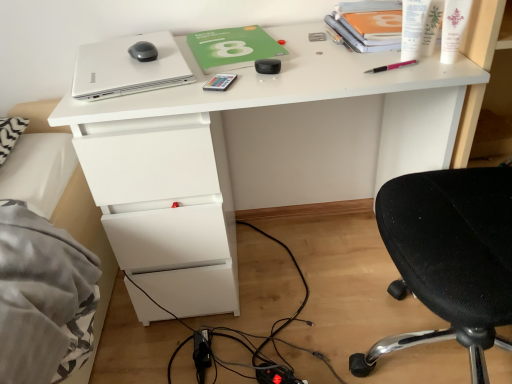
Locate an element on the screen. free location to the right of matte black mouse at upper left is located at coordinates (172, 55).